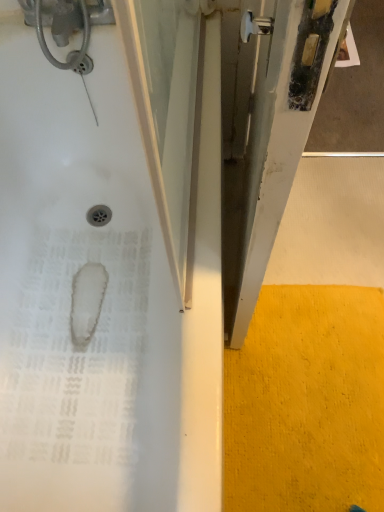
Question: From the image's perspective, is white glossy bathtub at left positioned above or below yellow textured carpet at lower right?

Choices:
 (A) below
 (B) above

Answer: (B)

Question: Considering the positions of white glossy bathtub at left and yellow textured carpet at lower right in the image, is white glossy bathtub at left wider or thinner than yellow textured carpet at lower right?

Choices:
 (A) thin
 (B) wide

Answer: (B)

Question: Does point (94, 102) appear closer or farther from the camera than point (288, 419)?

Choices:
 (A) closer
 (B) farther

Answer: (B)

Question: Would you say yellow textured carpet at lower right is to the left or to the right of white glossy bathtub at left in the picture?

Choices:
 (A) left
 (B) right

Answer: (B)

Question: Is yellow textured carpet at lower right spatially inside white glossy bathtub at left, or outside of it?

Choices:
 (A) outside
 (B) inside

Answer: (A)

Question: Considering the positions of point (246, 412) and point (195, 372), is point (246, 412) closer or farther from the camera than point (195, 372)?

Choices:
 (A) farther
 (B) closer

Answer: (A)

Question: Is yellow textured carpet at lower right bigger or smaller than white glossy bathtub at left?

Choices:
 (A) big
 (B) small

Answer: (B)